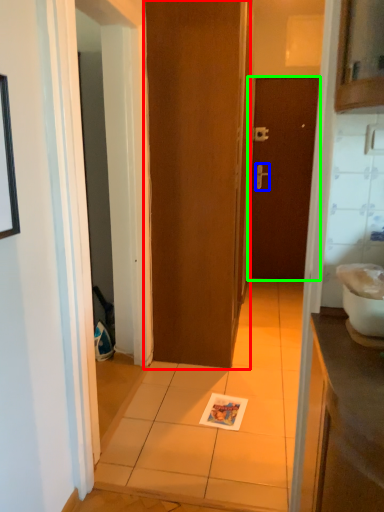
Question: Which object is the farthest from door (highlighted by a red box)? Choose among these: door handle (highlighted by a blue box) or door (highlighted by a green box).

Choices:
 (A) door handle
 (B) door

Answer: (A)